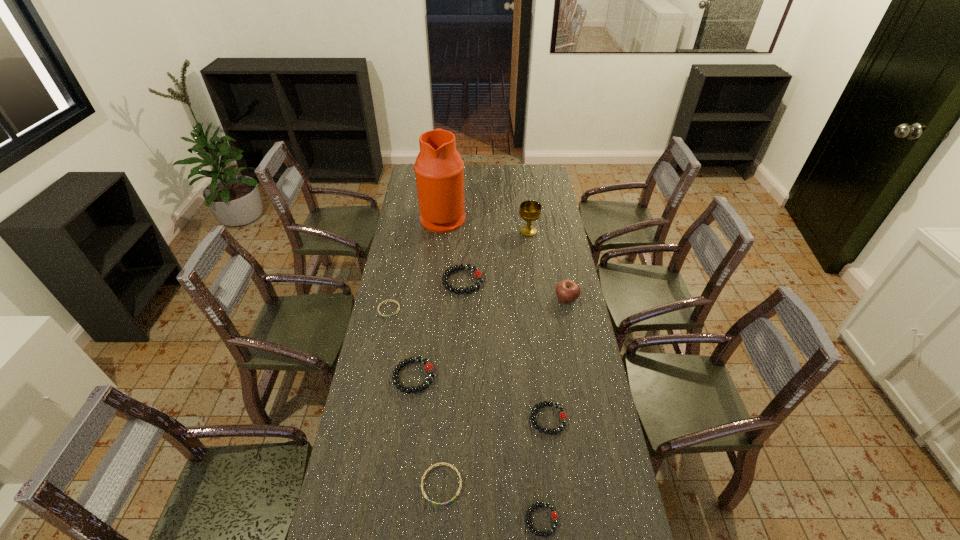
The width and height of the screenshot is (960, 540). Identify the location of water jug. (439, 169).

At what (x,y) coordinates should I click in order to perform the action: click on the tallest object. Please return your answer as a coordinate pair (x, y). The image size is (960, 540). Looking at the image, I should click on (439, 169).

Find the location of a particular element. This screenshot has height=540, width=960. the eighth shortest object is located at coordinates (530, 211).

Locate an element on the screen. This screenshot has height=540, width=960. the rightmost object is located at coordinates (567, 291).

You are a GUI agent. You are given a task and a screenshot of the screen. Output one action in this format:
    pyautogui.click(x=<x>, y=<y>)
    Task: Click on the apple
    The image size is (960, 540).
    Given the screenshot: What is the action you would take?
    pyautogui.click(x=567, y=291)

You are a GUI agent. You are given a task and a screenshot of the screen. Output one action in this format:
    pyautogui.click(x=<x>, y=<y>)
    Task: Click on the farthest black bracelet
    The height and width of the screenshot is (540, 960).
    Given the screenshot: What is the action you would take?
    pyautogui.click(x=478, y=274)

You are a GUI agent. You are given a task and a screenshot of the screen. Output one action in this format:
    pyautogui.click(x=<x>, y=<y>)
    Task: Click on the farthest bracelet
    Image resolution: width=960 pixels, height=540 pixels.
    Given the screenshot: What is the action you would take?
    pyautogui.click(x=478, y=274)

Locate an element on the screen. This screenshot has height=540, width=960. the second farthest black bracelet is located at coordinates [x=429, y=368].

Image resolution: width=960 pixels, height=540 pixels. Find the location of `the fourth nearest object`. the fourth nearest object is located at coordinates (429, 368).

Identify the location of the seventh farthest object. (563, 416).